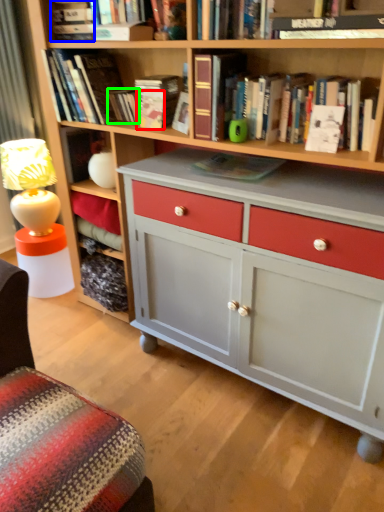
Question: Which is nearer to the paperback book (highlighted by a red box)? book (highlighted by a blue box) or paperback book (highlighted by a green box).

Choices:
 (A) book
 (B) paperback book

Answer: (B)